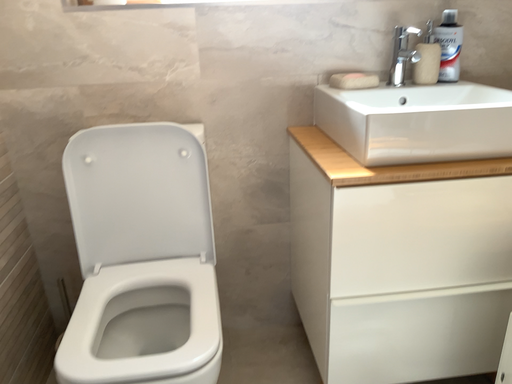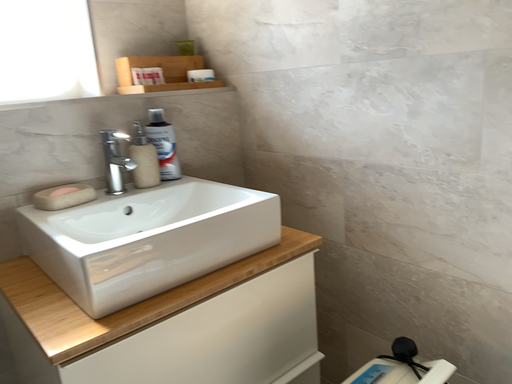
Question: How did the camera likely rotate when shooting the video?

Choices:
 (A) rotated upward
 (B) rotated downward

Answer: (A)